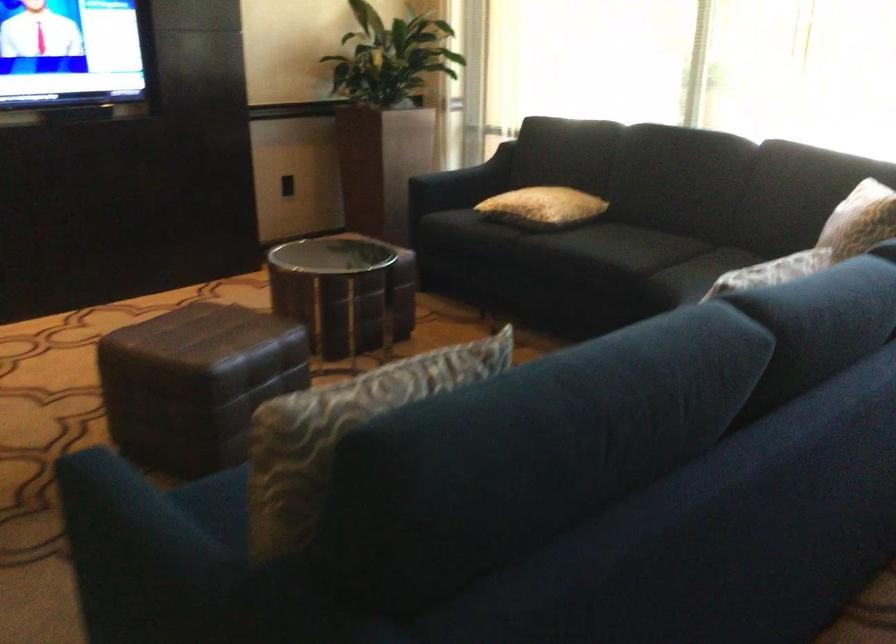
Identify the location of brown leather ottoman. (195, 383).